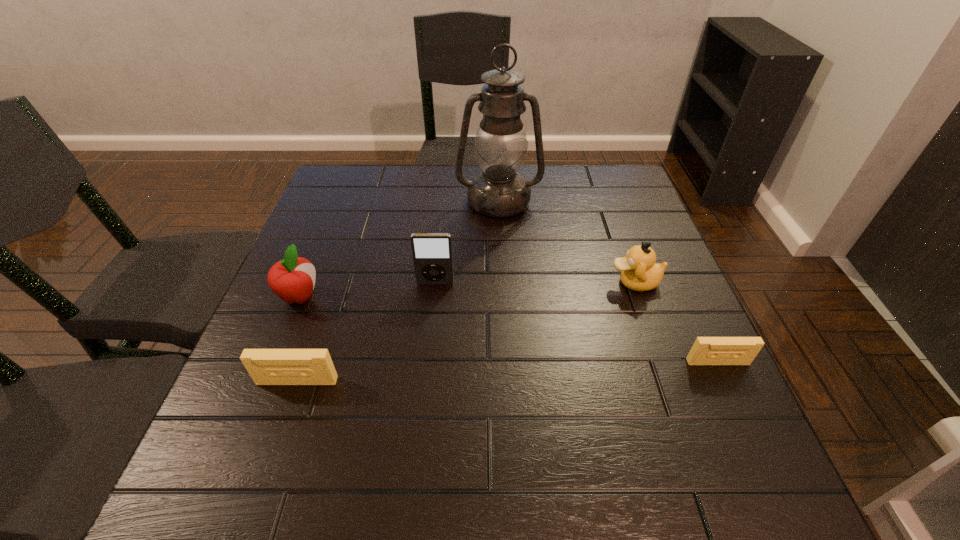
You are a GUI agent. You are given a task and a screenshot of the screen. Output one action in this format:
    pyautogui.click(x=<x>, y=<y>)
    Task: Click on the free region that satisfies the following two spatial constraints: 1. on the face of the duckling; 2. on the front-facing side of the iPod
    This screenshot has width=960, height=540.
    Given the screenshot: What is the action you would take?
    pyautogui.click(x=635, y=284)